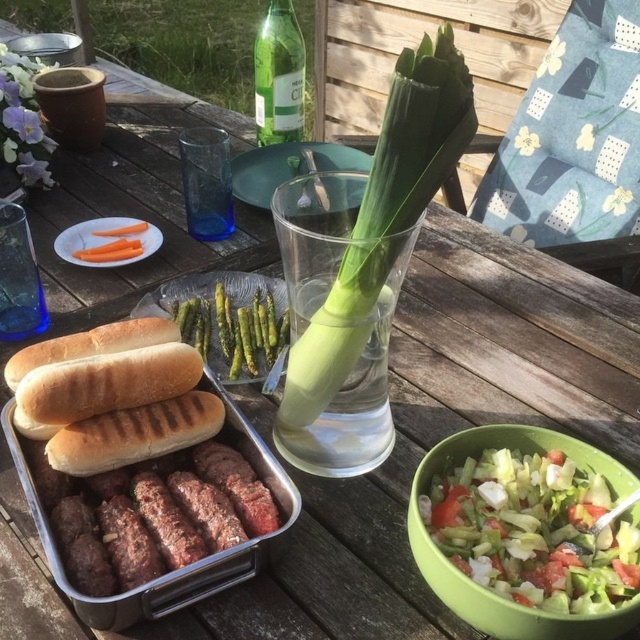
You are at the rustic outdoor dining setup. You see a point at coordinates (278, 76). Which object is this point located on?

The point at coordinates (278, 76) is located on the green glass bottle at upper center.

You are planning to serve a meal and need to know which item takes up more space on the table. Which is bigger between the fresh green salad at lower right and the brown toasted bread at center?

The fresh green salad at lower right is larger in size than the brown toasted bread at center, so the salad takes up more space on the table.

You are setting up a picnic and need to place a green glass bottle at upper center and a transparent glass at center. According to the scene, where should you position the green glass bottle relative to the transparent glass?

The green glass bottle at upper center should be placed to the left of the transparent glass at center.